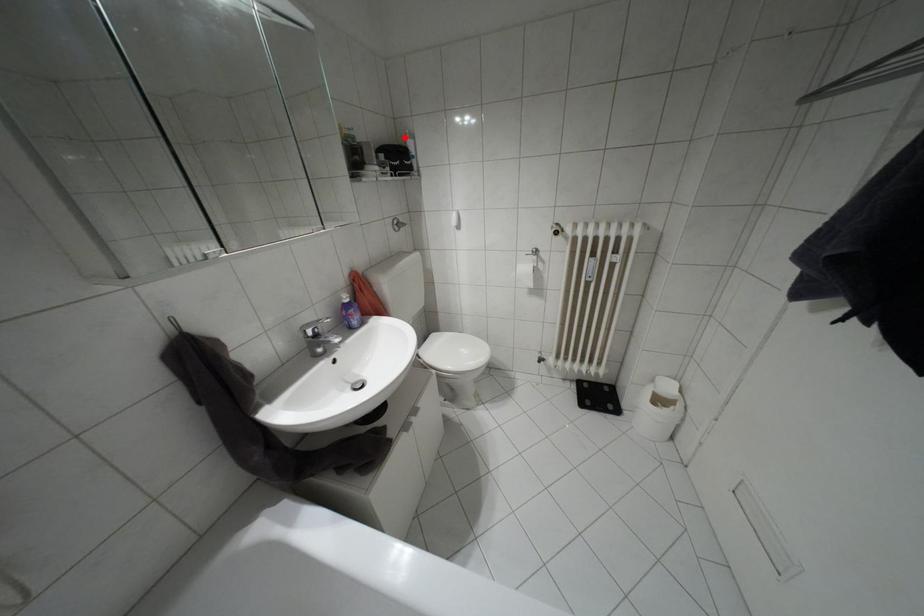
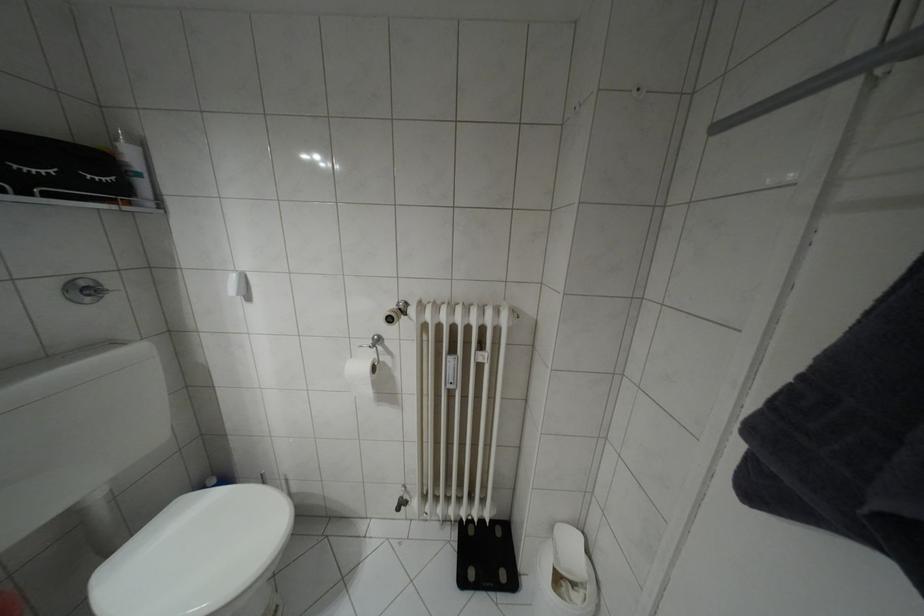
Find the pixel in the second image that matches the highlighted location in the first image.

(116, 139)